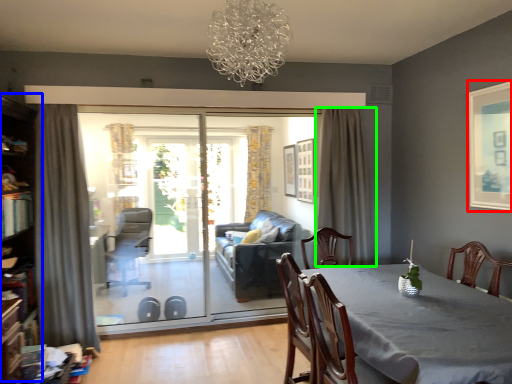
Question: Based on their relative distances, which object is nearer to picture frame (highlighted by a red box)? Choose from bookshelf (highlighted by a blue box) and curtain (highlighted by a green box).

Choices:
 (A) bookshelf
 (B) curtain

Answer: (B)